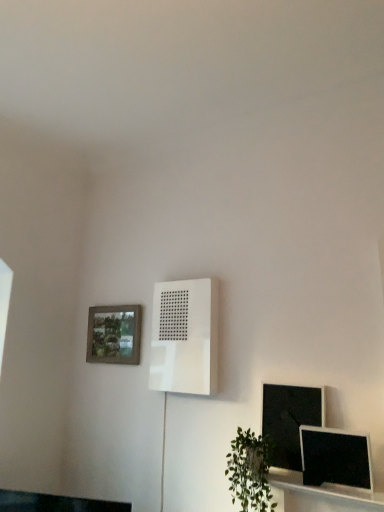
Describe the element at coordinates (250, 471) in the screenshot. I see `green leafy plant at lower right` at that location.

The height and width of the screenshot is (512, 384). What do you see at coordinates (289, 420) in the screenshot?
I see `matte black monitor at lower right, arranged as the 2th computer monitor when viewed from the front` at bounding box center [289, 420].

I want to click on green leafy plant at lower right, so click(250, 471).

Looking at the image, does green leafy plant at lower right seem bigger or smaller compared to wooden textured picture frame at upper left?

Clearly, green leafy plant at lower right is larger in size than wooden textured picture frame at upper left.

Does green leafy plant at lower right touch wooden textured picture frame at upper left?

No, green leafy plant at lower right is not in contact with wooden textured picture frame at upper left.

From their relative heights in the image, would you say green leafy plant at lower right is taller or shorter than wooden textured picture frame at upper left?

In the image, green leafy plant at lower right appears to be taller than wooden textured picture frame at upper left.

Is green leafy plant at lower right not inside wooden textured picture frame at upper left?

Yes, green leafy plant at lower right is outside of wooden textured picture frame at upper left.

Is point (95, 309) positioned after point (251, 489)?

Yes, point (95, 309) is farther from viewer.

Between wooden textured picture frame at upper left and green leafy plant at lower right, which one has larger size?

green leafy plant at lower right.

Which object is thinner, wooden textured picture frame at upper left or green leafy plant at lower right?

wooden textured picture frame at upper left is thinner.

Considering the sizes of matte black monitor at lower right, arranged as the 2th computer monitor when viewed from the front, and white matte air conditioner at center in the image, is matte black monitor at lower right, arranged as the 2th computer monitor when viewed from the front, taller or shorter than white matte air conditioner at center?

matte black monitor at lower right, arranged as the 2th computer monitor when viewed from the front, is shorter than white matte air conditioner at center.

From a real-world perspective, is matte black monitor at lower right, arranged as the 1th computer monitor when viewed from the back, located higher than white matte air conditioner at center?

Incorrect, from a real-world perspective, matte black monitor at lower right, arranged as the 1th computer monitor when viewed from the back, is lower than white matte air conditioner at center.

Is matte black monitor at lower right, arranged as the 1th computer monitor when viewed from the back, positioned with its back to white matte air conditioner at center?

No, matte black monitor at lower right, arranged as the 1th computer monitor when viewed from the back, is not facing the opposite direction of white matte air conditioner at center.

Locate an element on the screen. This screenshot has height=512, width=384. air conditioner that appears behind the matte black monitor at lower right, arranged as the 2th computer monitor when viewed from the front is located at coordinates (185, 337).

Is matte black monitor at lower right, marked as the second computer monitor in a back-to-front arrangement, far away from matte black monitor at lower right, arranged as the 1th computer monitor when viewed from the back?

No, matte black monitor at lower right, marked as the second computer monitor in a back-to-front arrangement, is not far away from matte black monitor at lower right, arranged as the 1th computer monitor when viewed from the back.

Considering the positions of objects matte black monitor at lower right, marked as the first computer monitor in a front-to-back arrangement, and matte black monitor at lower right, arranged as the 2th computer monitor when viewed from the front, in the image provided, who is more to the right, matte black monitor at lower right, marked as the first computer monitor in a front-to-back arrangement, or matte black monitor at lower right, arranged as the 2th computer monitor when viewed from the front,?

Positioned to the right is matte black monitor at lower right, marked as the first computer monitor in a front-to-back arrangement.

Considering the sizes of objects matte black monitor at lower right, marked as the first computer monitor in a front-to-back arrangement, and matte black monitor at lower right, arranged as the 1th computer monitor when viewed from the back, in the image provided, who is shorter, matte black monitor at lower right, marked as the first computer monitor in a front-to-back arrangement, or matte black monitor at lower right, arranged as the 1th computer monitor when viewed from the back,?

matte black monitor at lower right, marked as the first computer monitor in a front-to-back arrangement.

Consider the image. From a real-world perspective, which object stands above the other?

white matte air conditioner at center is physically above.

Consider the image. Who is smaller, matte black monitor at lower right, marked as the second computer monitor in a back-to-front arrangement, or white matte air conditioner at center?

With smaller size is matte black monitor at lower right, marked as the second computer monitor in a back-to-front arrangement.

Is matte black monitor at lower right, marked as the second computer monitor in a back-to-front arrangement, oriented away from white matte air conditioner at center?

No.

Between point (366, 455) and point (168, 338), which one is positioned in front?

The point (366, 455) is closer to the camera.

Between green leafy plant at lower right and matte black monitor at lower right, arranged as the 2th computer monitor when viewed from the front, which one has larger size?

Bigger between the two is green leafy plant at lower right.

Consider the image. Visually, is green leafy plant at lower right positioned to the left or to the right of matte black monitor at lower right, arranged as the 1th computer monitor when viewed from the back?

Clearly, green leafy plant at lower right is on the left of matte black monitor at lower right, arranged as the 1th computer monitor when viewed from the back, in the image.

From their relative heights in the image, would you say green leafy plant at lower right is taller or shorter than matte black monitor at lower right, arranged as the 2th computer monitor when viewed from the front?

Clearly, green leafy plant at lower right is taller compared to matte black monitor at lower right, arranged as the 2th computer monitor when viewed from the front.

Is white matte air conditioner at center in front of or behind matte black monitor at lower right, marked as the first computer monitor in a front-to-back arrangement, in the image?

In the image, white matte air conditioner at center appears behind matte black monitor at lower right, marked as the first computer monitor in a front-to-back arrangement.

Is point (204, 286) in front of point (342, 467)?

That is False.

Which is more to the left, white matte air conditioner at center or matte black monitor at lower right, marked as the first computer monitor in a front-to-back arrangement?

Positioned to the left is white matte air conditioner at center.

Measure the distance from white matte air conditioner at center to matte black monitor at lower right, marked as the second computer monitor in a back-to-front arrangement.

white matte air conditioner at center and matte black monitor at lower right, marked as the second computer monitor in a back-to-front arrangement, are 73.64 centimeters apart.

You are a GUI agent. You are given a task and a screenshot of the screen. Output one action in this format:
    pyautogui.click(x=<x>, y=<y>)
    Task: Click on the picture frame above the green leafy plant at lower right (from a real-world perspective)
    This screenshot has width=384, height=512.
    Given the screenshot: What is the action you would take?
    pyautogui.click(x=114, y=334)

The width and height of the screenshot is (384, 512). In the image, there is a green leafy plant at lower right. What are the coordinates of `picture frame above it (from the image's perspective)` in the screenshot? It's located at (114, 334).

When comparing their distances from wooden textured picture frame at upper left, does green leafy plant at lower right or white matte air conditioner at center seem further?

The object further to wooden textured picture frame at upper left is green leafy plant at lower right.

Considering their positions, is matte black monitor at lower right, arranged as the 1th computer monitor when viewed from the back, positioned closer to matte black monitor at lower right, marked as the second computer monitor in a back-to-front arrangement, than white matte air conditioner at center?

matte black monitor at lower right, arranged as the 1th computer monitor when viewed from the back, is closer to matte black monitor at lower right, marked as the second computer monitor in a back-to-front arrangement.

From the image, which object appears to be farther from green leafy plant at lower right, matte black monitor at lower right, arranged as the 2th computer monitor when viewed from the front, or wooden textured picture frame at upper left?

wooden textured picture frame at upper left.

Considering their positions, is matte black monitor at lower right, arranged as the 1th computer monitor when viewed from the back, positioned further to wooden textured picture frame at upper left than matte black monitor at lower right, marked as the second computer monitor in a back-to-front arrangement?

Based on the image, matte black monitor at lower right, marked as the second computer monitor in a back-to-front arrangement, appears to be further to wooden textured picture frame at upper left.

Consider the image. Looking at the image, which one is located further to green leafy plant at lower right, matte black monitor at lower right, arranged as the 1th computer monitor when viewed from the back, or matte black monitor at lower right, marked as the second computer monitor in a back-to-front arrangement?

matte black monitor at lower right, marked as the second computer monitor in a back-to-front arrangement, lies further to green leafy plant at lower right than the other object.

Which object lies nearer to the anchor point green leafy plant at lower right, white matte air conditioner at center or matte black monitor at lower right, arranged as the 2th computer monitor when viewed from the front?

Based on the image, matte black monitor at lower right, arranged as the 2th computer monitor when viewed from the front, appears to be nearer to green leafy plant at lower right.

Based on their spatial positions, is matte black monitor at lower right, marked as the second computer monitor in a back-to-front arrangement, or white matte air conditioner at center further from matte black monitor at lower right, arranged as the 2th computer monitor when viewed from the front?

Based on the image, white matte air conditioner at center appears to be further to matte black monitor at lower right, arranged as the 2th computer monitor when viewed from the front.

Based on their spatial positions, is wooden textured picture frame at upper left or green leafy plant at lower right further from white matte air conditioner at center?

The object further to white matte air conditioner at center is green leafy plant at lower right.

At what (x,y) coordinates should I click in order to perform the action: click on computer monitor between white matte air conditioner at center and matte black monitor at lower right, marked as the second computer monitor in a back-to-front arrangement. Please return your answer as a coordinate pair (x, y). This screenshot has height=512, width=384. Looking at the image, I should click on (289, 420).

You are a GUI agent. You are given a task and a screenshot of the screen. Output one action in this format:
    pyautogui.click(x=<x>, y=<y>)
    Task: Click on the houseplant between white matte air conditioner at center and matte black monitor at lower right, marked as the second computer monitor in a back-to-front arrangement, from left to right
    This screenshot has height=512, width=384.
    Given the screenshot: What is the action you would take?
    pyautogui.click(x=250, y=471)

At what (x,y) coordinates should I click in order to perform the action: click on houseplant between wooden textured picture frame at upper left and matte black monitor at lower right, arranged as the 2th computer monitor when viewed from the front, from left to right. Please return your answer as a coordinate pair (x, y). Image resolution: width=384 pixels, height=512 pixels. Looking at the image, I should click on (250, 471).

Image resolution: width=384 pixels, height=512 pixels. What are the coordinates of `air conditioner between wooden textured picture frame at upper left and matte black monitor at lower right, arranged as the 1th computer monitor when viewed from the back, from left to right` in the screenshot? It's located at (185, 337).